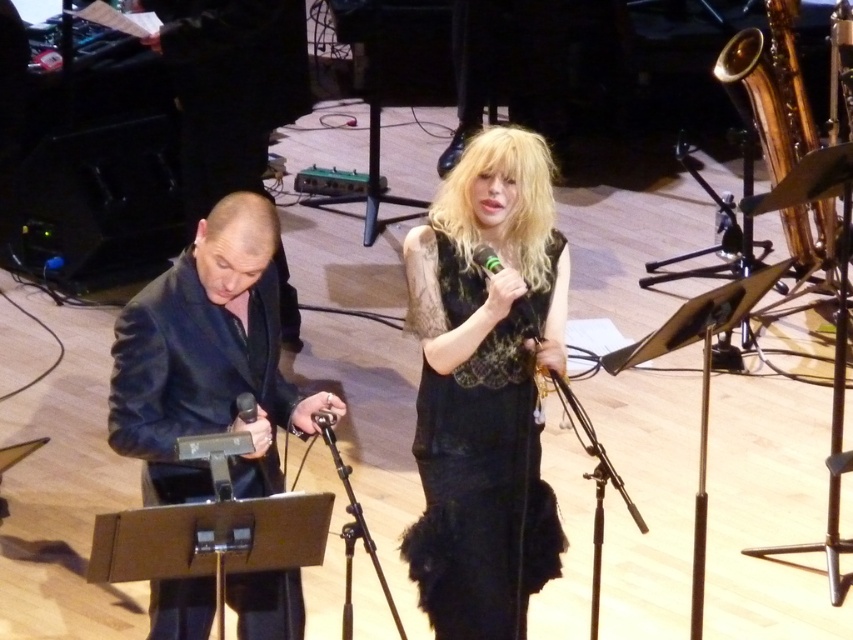
Does gold brass saxophone at upper right lie in front of black matte microphone at center?

That is False.

Looking at this image, which of these two, gold brass saxophone at upper right or black matte microphone at center, stands taller?

gold brass saxophone at upper right

Which is behind, point (791, 227) or point (254, 404)?

The point (791, 227) is behind.

Identify the location of gold brass saxophone at upper right. The width and height of the screenshot is (853, 640). (769, 90).

Based on the photo, can you confirm if green metallic microphone at center is taller than black matte microphone at center?

Yes, green metallic microphone at center is taller than black matte microphone at center.

You are a GUI agent. You are given a task and a screenshot of the screen. Output one action in this format:
    pyautogui.click(x=<x>, y=<y>)
    Task: Click on the green metallic microphone at center
    This screenshot has width=853, height=640.
    Given the screenshot: What is the action you would take?
    pyautogui.click(x=526, y=317)

This screenshot has height=640, width=853. What do you see at coordinates (526, 317) in the screenshot?
I see `green metallic microphone at center` at bounding box center [526, 317].

Identify the location of green metallic microphone at center. The image size is (853, 640). (526, 317).

Does point (521, 499) lie in front of point (537, 320)?

No, it is not.

Is point (505, 259) positioned in front of point (485, 252)?

No, (505, 259) is behind (485, 252).

Where is `black lace dress at center`? This screenshot has height=640, width=853. black lace dress at center is located at coordinates (485, 388).